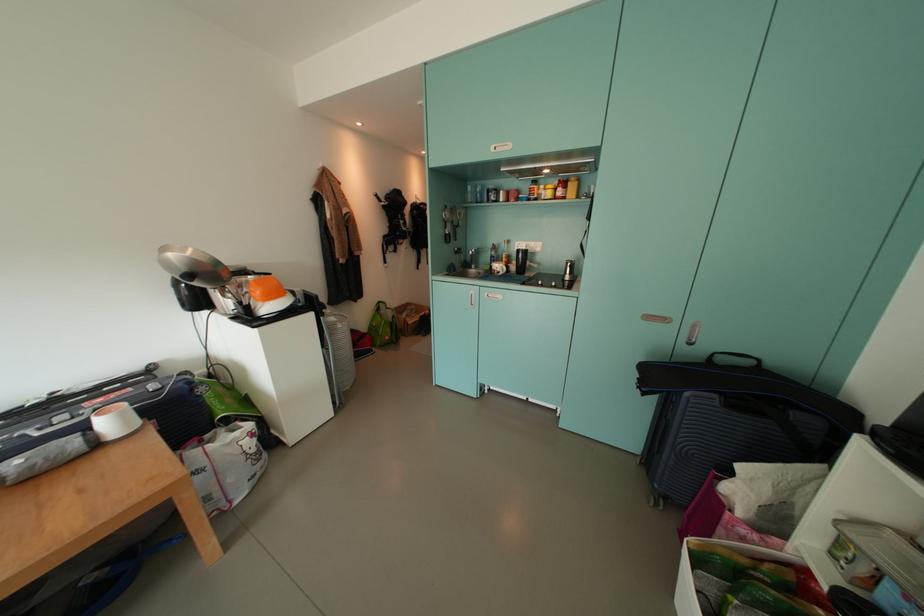
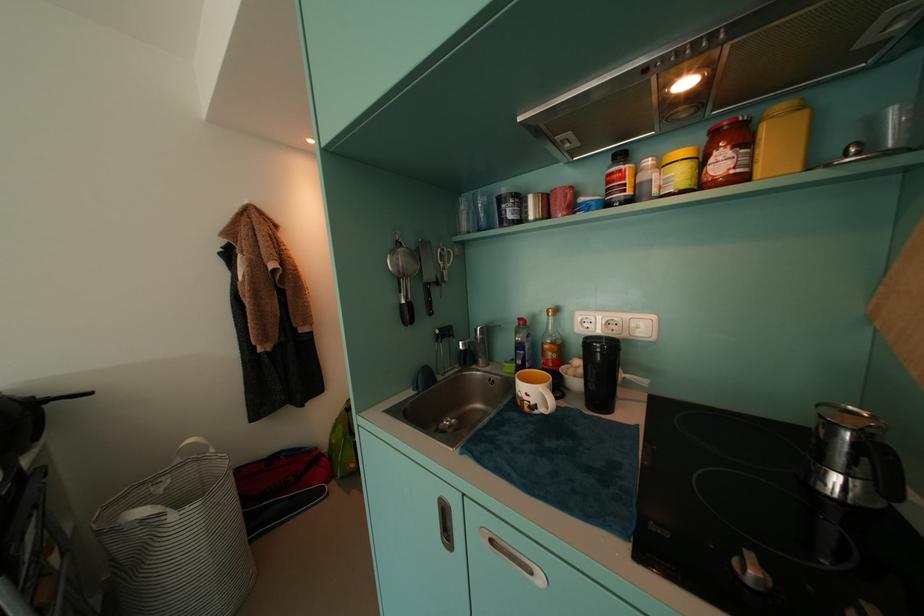
In the second image, find the point that corresponds to (x=508, y=276) in the first image.

(550, 413)